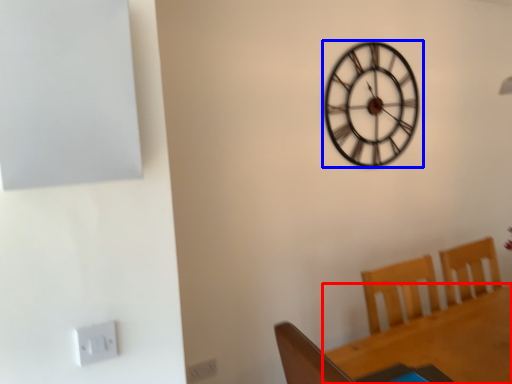
Question: Which object is further to the camera taking this photo, round table (highlighted by a red box) or wall clock (highlighted by a blue box)?

Choices:
 (A) round table
 (B) wall clock

Answer: (B)